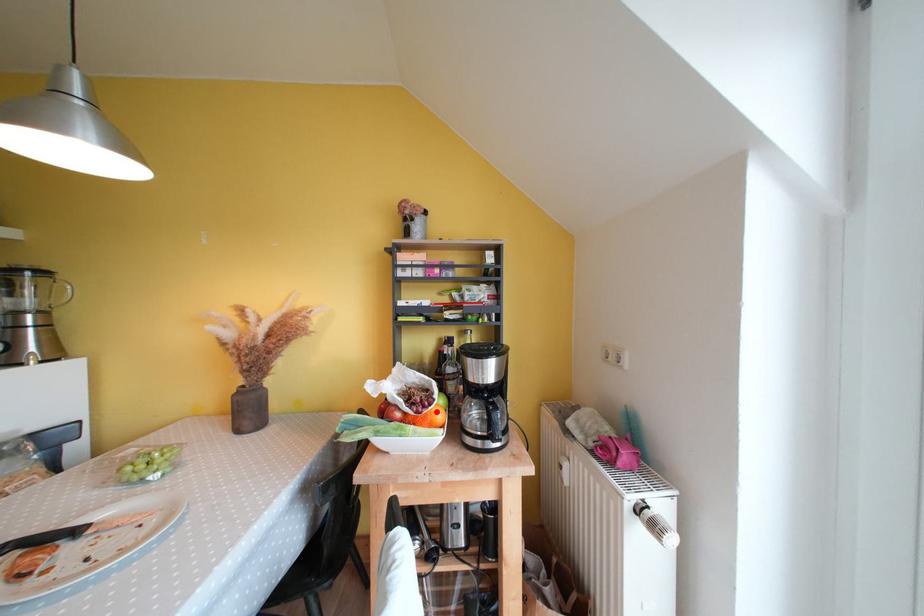
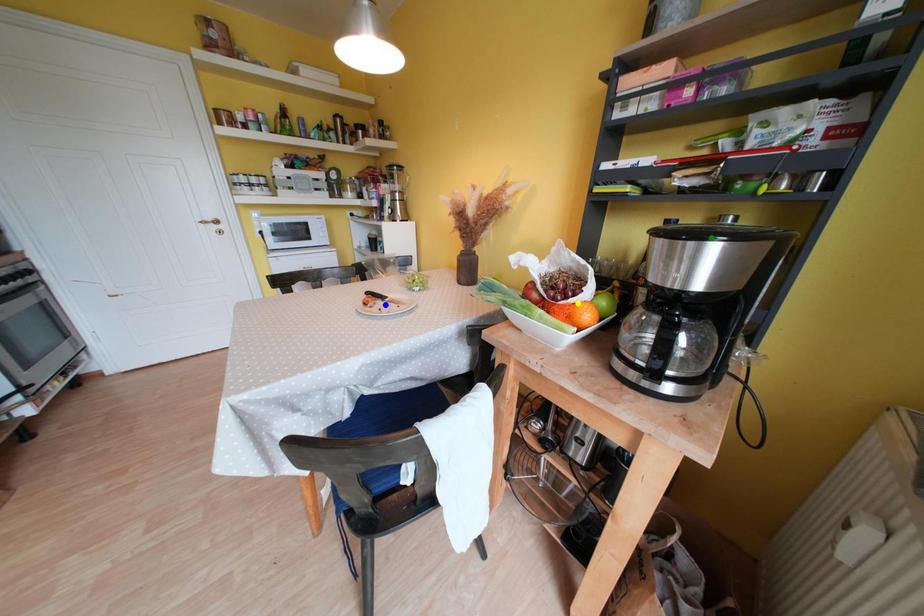
Question: I am providing you with two images of the same scene from different viewpoints. A red point is marked on the first image. You are given multiple points on the second image. Can you choose the point in image 2 that corresponds to the point in image 1?

Choices:
 (A) yellow point
 (B) blue point
 (C) green point

Answer: (A)